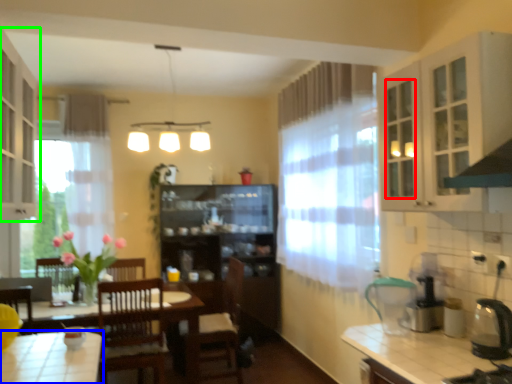
Question: Which object is positioned closest to glass door (highlighted by a red box)? Select from kitchen & dining room table (highlighted by a blue box) and cabinetry (highlighted by a green box).

Choices:
 (A) kitchen & dining room table
 (B) cabinetry

Answer: (B)